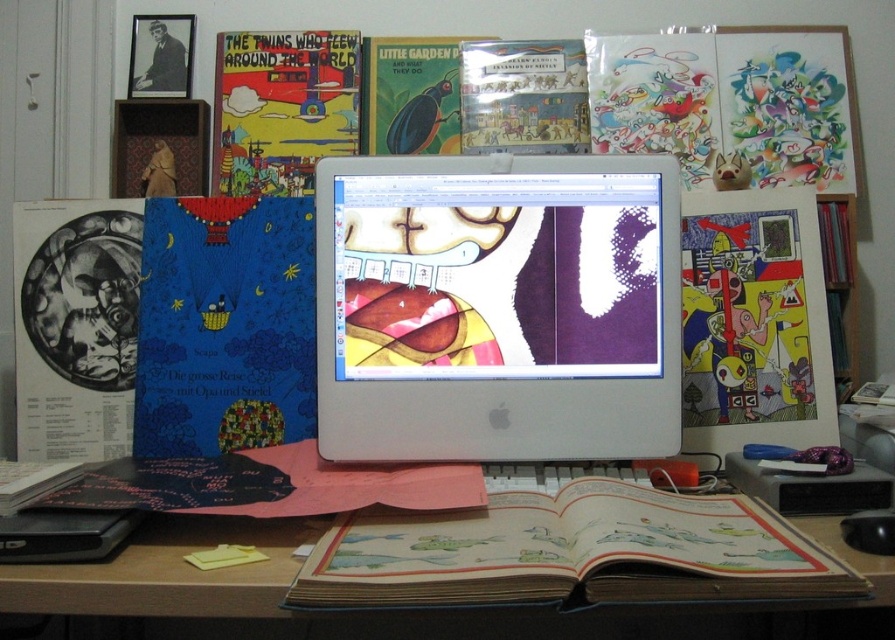
You are organizing items on your desk and want to place a new item between the silver metallic monitor at center and the matte black book at left. Is there enough space to place it there?

The silver metallic monitor at center is to the right of the matte black book at left, so there is space between them to place a new item.

You are organizing the desk and want to place a new item between the matte black book at left and the yellow paper comic book at center right. Is there enough space between them for a 10cm wide object?

The matte black book at left is behind the yellow paper comic book at center right, so there is no space between them for a 10cm wide object.

You are organizing a desk and need to place the yellow paper comic book at center right and the wooden desk at center. Which object is taller?

The yellow paper comic book at center right is much taller than the wooden desk at center.